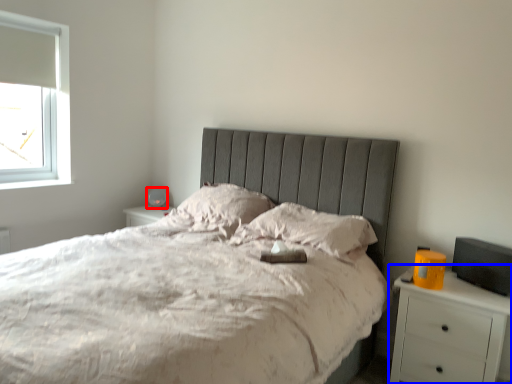
Question: Among these objects, which one is nearest to the camera, table lamp (highlighted by a red box) or nightstand (highlighted by a blue box)?

Choices:
 (A) table lamp
 (B) nightstand

Answer: (B)